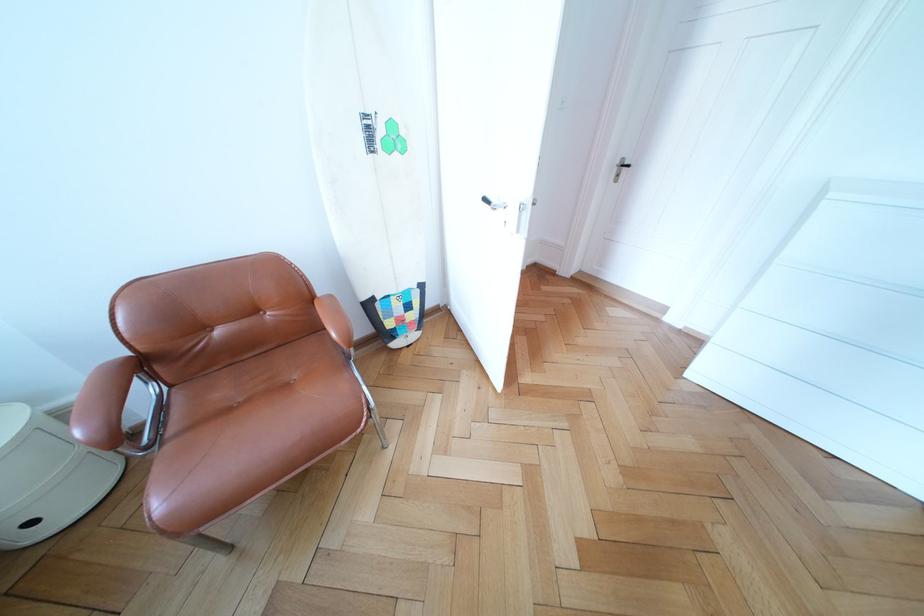
What do you see at coordinates (265, 413) in the screenshot? The height and width of the screenshot is (616, 924). I see `a brown chair sitting surface` at bounding box center [265, 413].